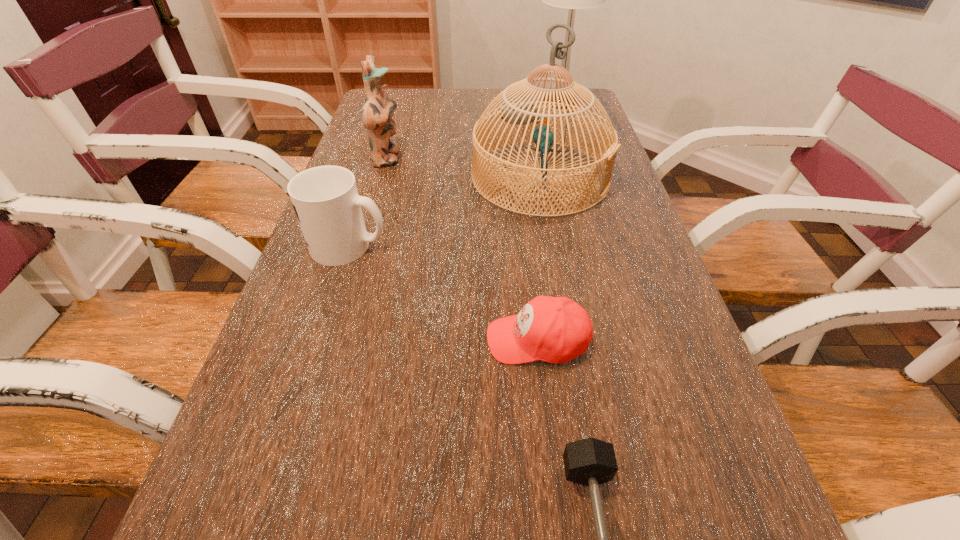
Find the location of a particular element. the farthest object is located at coordinates pos(572,0).

Identify the location of the fifth shortest object. (518, 113).

At what (x,y) coordinates should I click in order to perform the action: click on figurine. Please return your answer as a coordinate pair (x, y). Looking at the image, I should click on (378, 110).

In order to click on the third nearest object in this screenshot , I will do `click(325, 198)`.

In order to click on the third shortest object in this screenshot , I will do `click(325, 198)`.

I want to click on the fifth farthest object, so click(553, 329).

Identify the location of the fifth tallest object. This screenshot has height=540, width=960. (553, 329).

You are a GUI agent. You are given a task and a screenshot of the screen. Output one action in this format:
    pyautogui.click(x=<x>, y=<y>)
    Task: Click on the vacant space located 0.070m above the cylindrical shade of the table lamp
    The width and height of the screenshot is (960, 540).
    Given the screenshot: What is the action you would take?
    pyautogui.click(x=513, y=101)

This screenshot has width=960, height=540. I want to click on vacant region located above the cylindrical shade of the table lamp, so click(x=428, y=101).

At what (x,y) coordinates should I click in order to perform the action: click on free space located above the cylindrical shade of the table lamp. Please return your answer as a coordinate pair (x, y). This screenshot has width=960, height=540. Looking at the image, I should click on (420, 101).